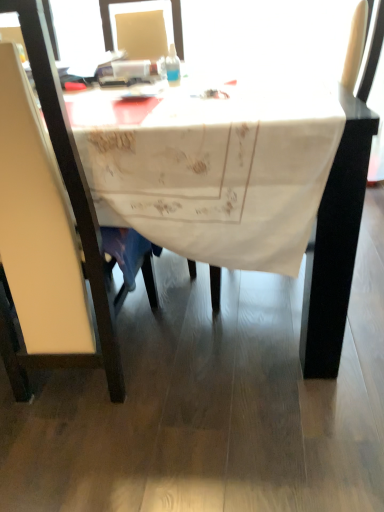
The width and height of the screenshot is (384, 512). In order to click on unoccupied space behind transparent plastic bottle at center in this screenshot , I will do `click(171, 77)`.